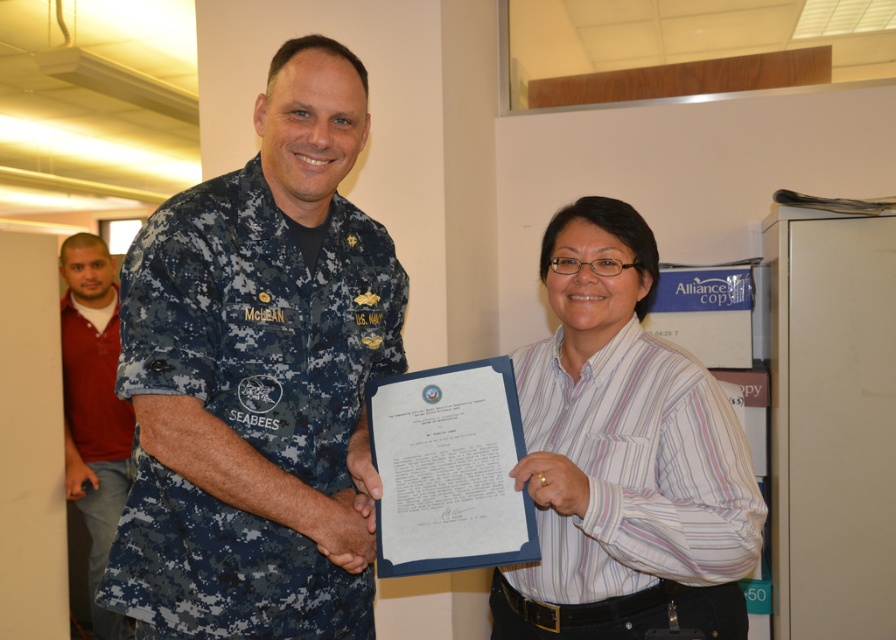
Is white striped shirt at center wider than red cotton shirt at left?

Yes.

Does point (625, 516) come farther from viewer compared to point (122, 467)?

No, (625, 516) is in front of (122, 467).

Locate an element on the screen. white striped shirt at center is located at coordinates (636, 470).

Does digital camouflage uniform at center have a lesser height compared to white striped shirt at center?

In fact, digital camouflage uniform at center may be taller than white striped shirt at center.

Can you confirm if digital camouflage uniform at center is positioned above white striped shirt at center?

Indeed, digital camouflage uniform at center is positioned over white striped shirt at center.

The image size is (896, 640). In order to click on digital camouflage uniform at center in this screenshot , I will do `click(263, 317)`.

Can you confirm if digital camouflage uniform at center is bigger than red cotton shirt at left?

No, digital camouflage uniform at center is not bigger than red cotton shirt at left.

Between digital camouflage uniform at center and red cotton shirt at left, which one appears on the right side from the viewer's perspective?

Positioned to the right is digital camouflage uniform at center.

Does point (237, 609) lie behind point (98, 561)?

No.

The width and height of the screenshot is (896, 640). I want to click on digital camouflage uniform at center, so click(263, 317).